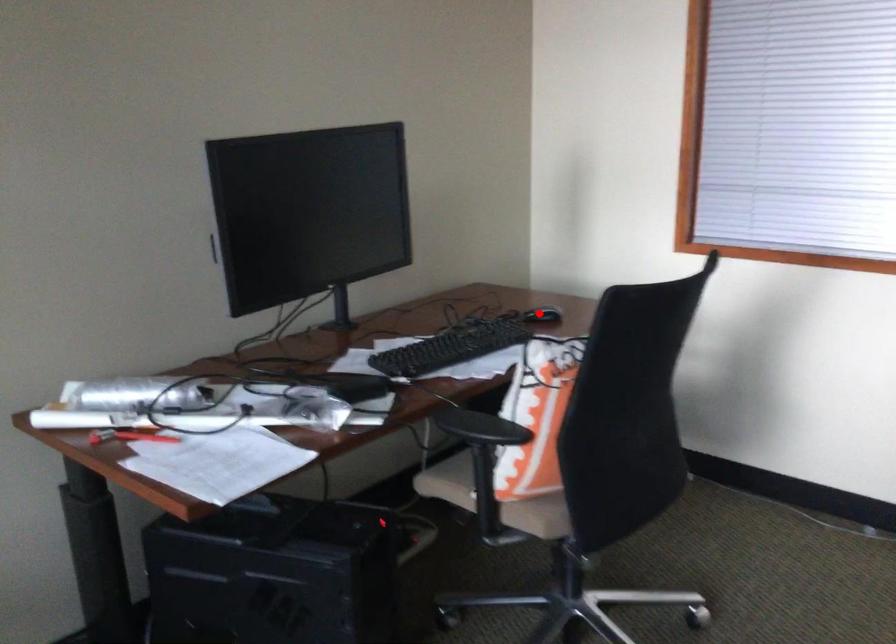
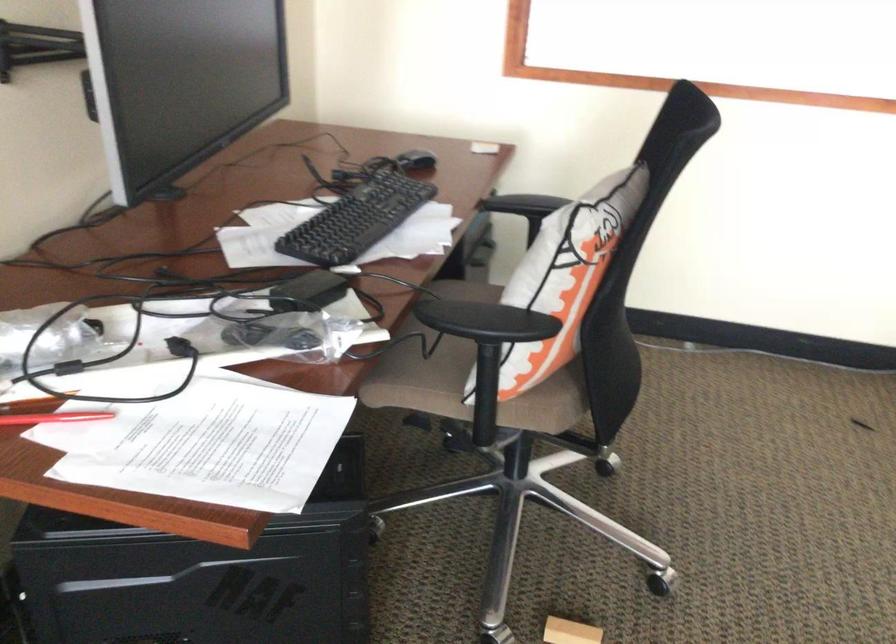
Question: I am providing you with two images of the same scene from different viewpoints. In image1, a red point is highlighted. Considering the same 3D point in image2, which of the following is correct?

Choices:
 (A) It is closer
 (B) It is farther

Answer: (A)